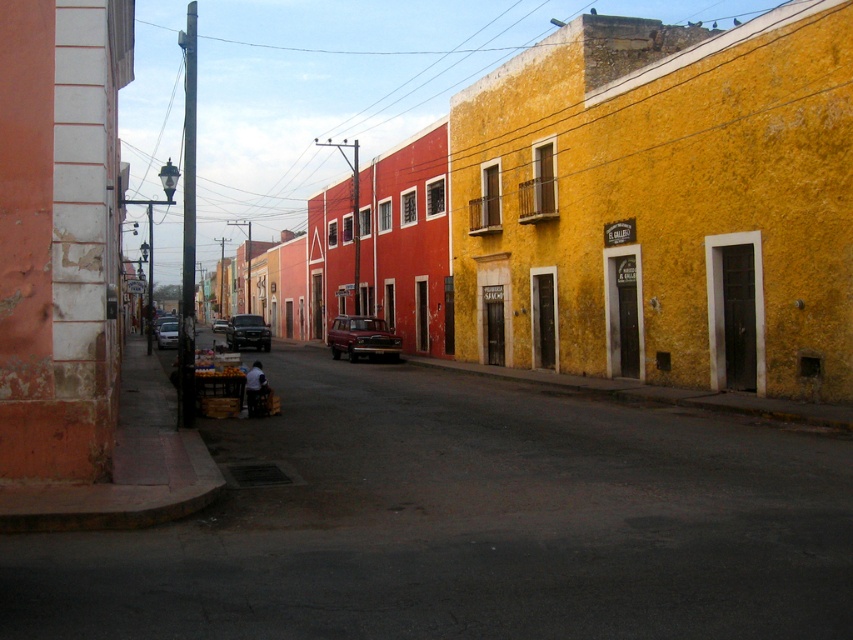
You are driving a shiny red car at center and want to park it in a parking spot that can only accommodate vehicles up to the size of the metallic silver truck at center. Can your car fit in the spot?

The shiny red car at center is smaller than the metallic silver truck at center, so yes, the car can fit in the parking spot designed for the truck.

You are a delivery driver who needs to park your vehicle in this street scene. You have a shiny red car at center and a metallic silver truck at center in front of you. Which vehicle should you avoid parking to the left of to ensure you don not block the road?

You should avoid parking to the left of the metallic silver truck at center because the shiny red car at center is already positioned to its right, which means parking further left might block the road.